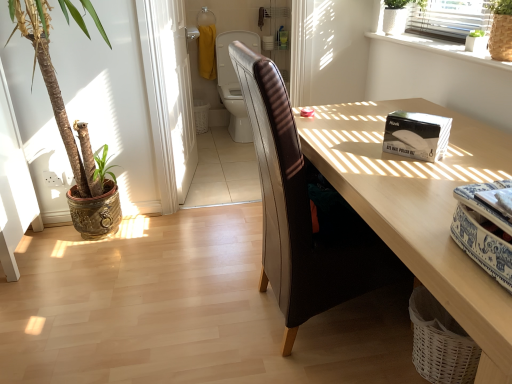
Question: Would you say green leafy plant at upper right, positioned as the second houseplant in right-to-left order, is outside leather-like brown swivel chair at center?

Choices:
 (A) yes
 (B) no

Answer: (A)

Question: Does green leafy plant at upper right, positioned as the second houseplant in right-to-left order, have a lesser height compared to leather-like brown swivel chair at center?

Choices:
 (A) yes
 (B) no

Answer: (A)

Question: Is green leafy plant at upper right, which is counted as the third houseplant, starting from the left, closer to the viewer compared to leather-like brown swivel chair at center?

Choices:
 (A) no
 (B) yes

Answer: (B)

Question: Is green leafy plant at upper right, which is counted as the third houseplant, starting from the left, at the right side of leather-like brown swivel chair at center?

Choices:
 (A) no
 (B) yes

Answer: (B)

Question: Is green leafy plant at upper right, which is counted as the third houseplant, starting from the left, taller than leather-like brown swivel chair at center?

Choices:
 (A) yes
 (B) no

Answer: (B)

Question: Can you confirm if green leafy plant at upper right, positioned as the second houseplant in right-to-left order, is smaller than leather-like brown swivel chair at center?

Choices:
 (A) no
 (B) yes

Answer: (B)

Question: From the image's perspective, is white glossy screen door at upper center above white textured plant at upper right, marked as the 2th houseplant in a left-to-right arrangement?

Choices:
 (A) no
 (B) yes

Answer: (A)

Question: Is white glossy screen door at upper center looking in the opposite direction of white textured plant at upper right, marked as the 2th houseplant in a left-to-right arrangement?

Choices:
 (A) no
 (B) yes

Answer: (A)

Question: Is white glossy screen door at upper center at the right side of white textured plant at upper right, marked as the 2th houseplant in a left-to-right arrangement?

Choices:
 (A) no
 (B) yes

Answer: (A)

Question: Can white textured plant at upper right, placed as the 3th houseplant when sorted from right to left, be found inside white glossy screen door at upper center?

Choices:
 (A) yes
 (B) no

Answer: (B)

Question: Is white glossy screen door at upper center closer to the viewer compared to white textured plant at upper right, marked as the 2th houseplant in a left-to-right arrangement?

Choices:
 (A) yes
 (B) no

Answer: (B)

Question: From the image's perspective, is white glossy screen door at upper center located beneath white textured plant at upper right, placed as the 3th houseplant when sorted from right to left?

Choices:
 (A) yes
 (B) no

Answer: (A)

Question: Can you confirm if green leafy plant at upper right, which is counted as the third houseplant, starting from the left, is wider than green woven basket at upper right, the first houseplant from the right?

Choices:
 (A) no
 (B) yes

Answer: (A)